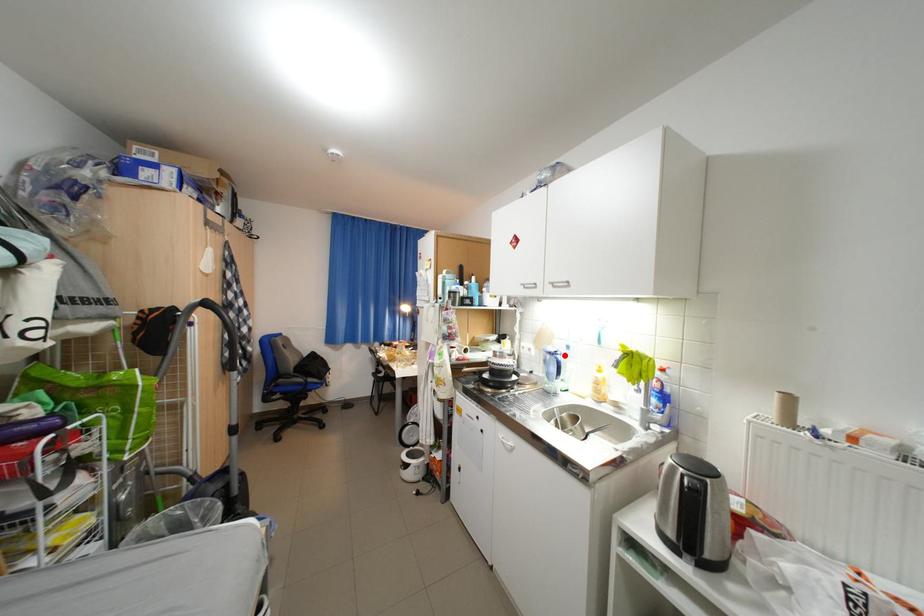
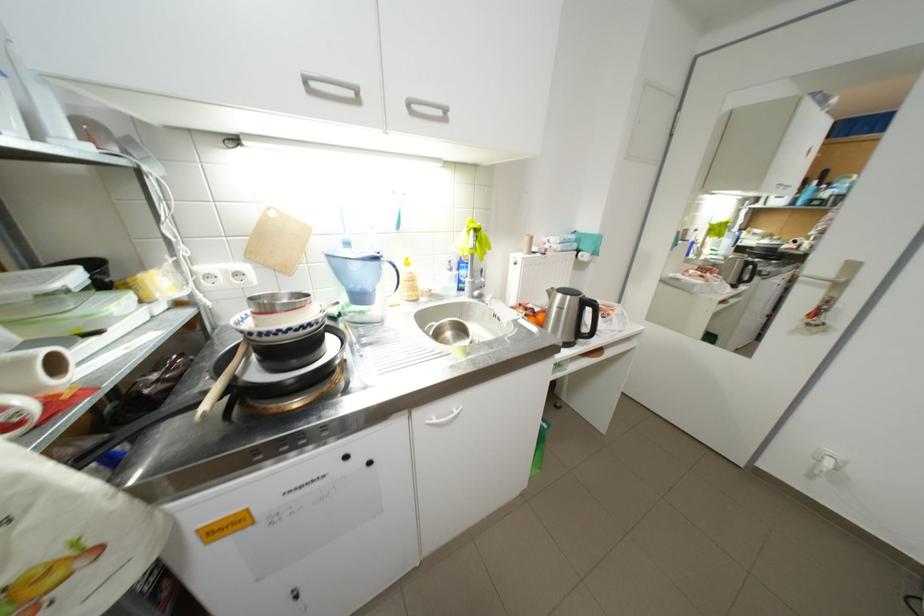
In the second image, find the point that corresponds to the highlighted location in the first image.

(387, 259)